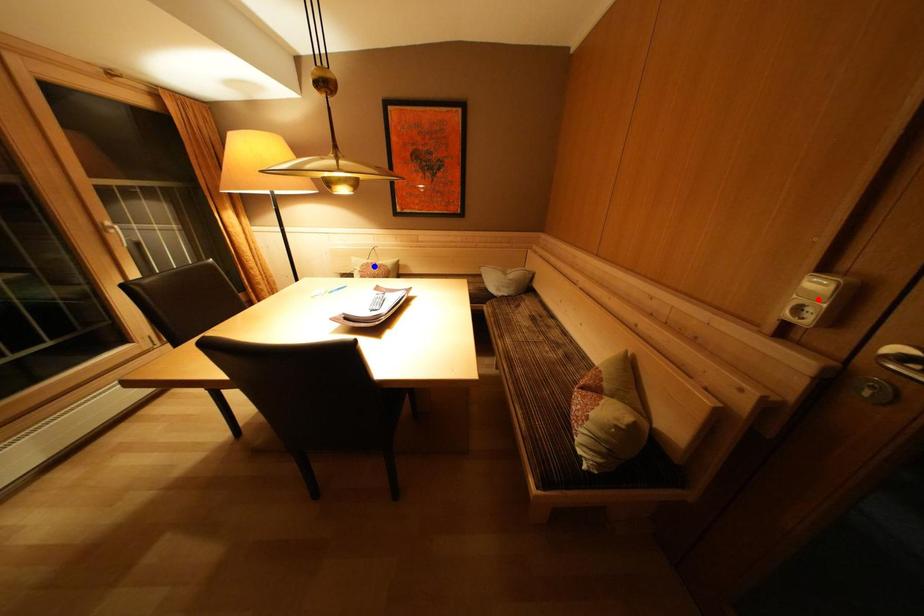
Question: In the image, two points are highlighted. Which point is nearer to the camera? Reply with the corresponding letter.

Choices:
 (A) blue point
 (B) red point

Answer: (B)